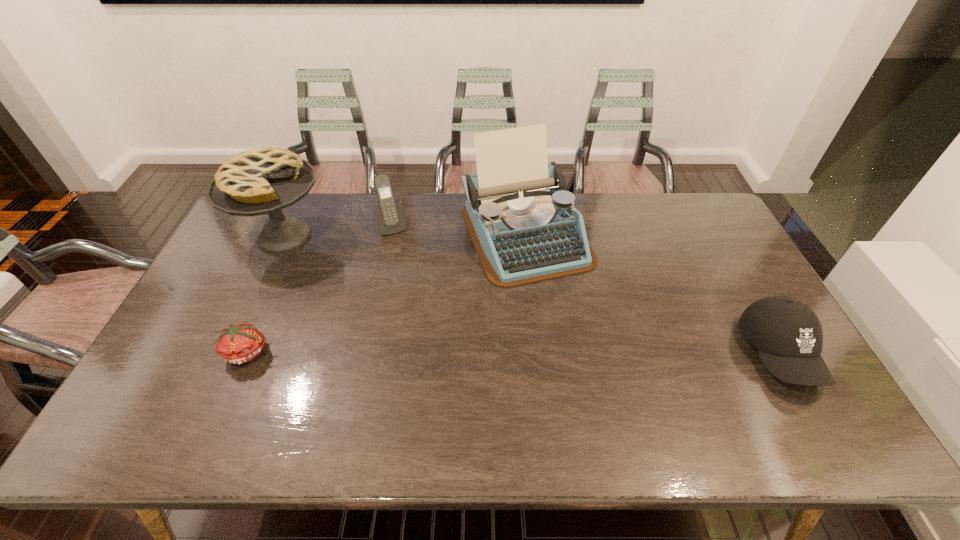
Where is `object at the near edge`? The image size is (960, 540). object at the near edge is located at coordinates (788, 335).

The height and width of the screenshot is (540, 960). I want to click on tomato that is at the left edge, so click(x=238, y=343).

You are a GUI agent. You are given a task and a screenshot of the screen. Output one action in this format:
    pyautogui.click(x=<x>, y=<y>)
    Task: Click on the pie at the left edge
    The width and height of the screenshot is (960, 540).
    Given the screenshot: What is the action you would take?
    pyautogui.click(x=258, y=181)

At what (x,y) coordinates should I click in order to perform the action: click on object located at the right edge. Please return your answer as a coordinate pair (x, y). This screenshot has height=540, width=960. Looking at the image, I should click on (788, 335).

Where is `object that is at the far left corner`? Image resolution: width=960 pixels, height=540 pixels. object that is at the far left corner is located at coordinates pyautogui.click(x=258, y=181).

You are a GUI agent. You are given a task and a screenshot of the screen. Output one action in this format:
    pyautogui.click(x=<x>, y=<y>)
    Task: Click on the object located at the near right corner
    The height and width of the screenshot is (540, 960).
    Given the screenshot: What is the action you would take?
    pyautogui.click(x=788, y=335)

The width and height of the screenshot is (960, 540). I want to click on free region at the far edge of the desktop, so click(360, 210).

The image size is (960, 540). Identify the location of vacant space at the near edge. (305, 373).

The height and width of the screenshot is (540, 960). I want to click on free location at the left edge of the desktop, so click(x=243, y=242).

This screenshot has height=540, width=960. What are the coordinates of `free space at the right edge of the desktop` in the screenshot? It's located at (733, 256).